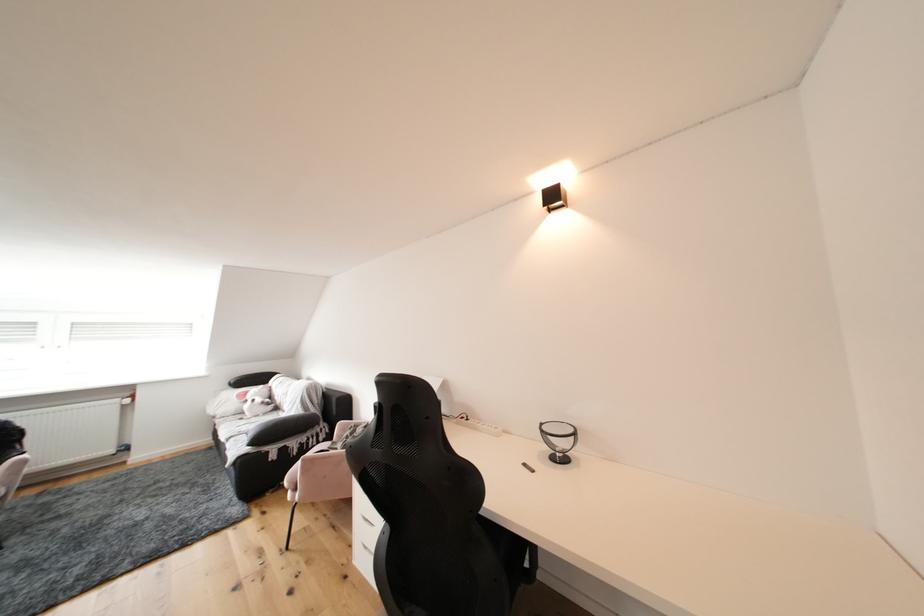
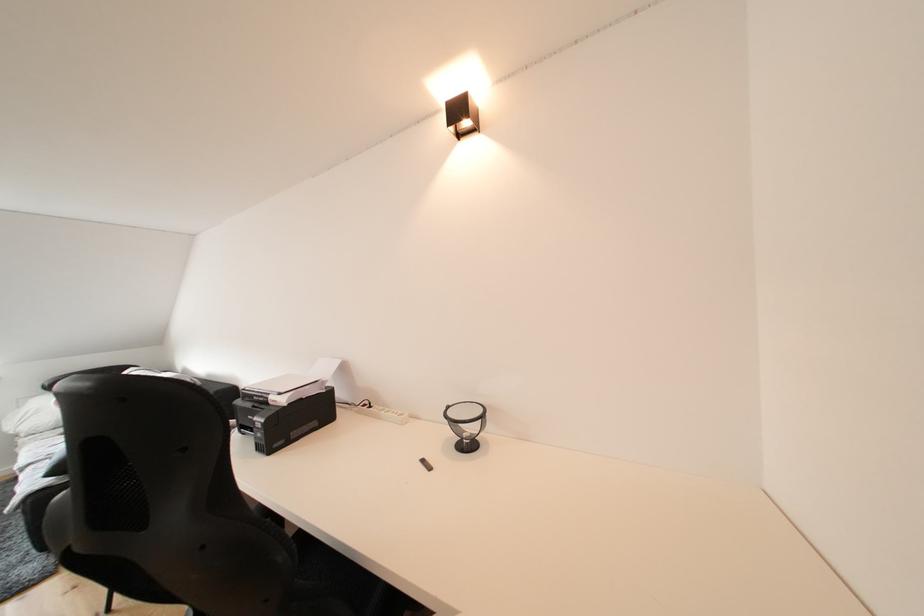
Question: The first image is from the beginning of the video and the second image is from the end. How did the camera likely rotate when shooting the video?

Choices:
 (A) Left
 (B) Right
 (C) Up
 (D) Down

Answer: (B)